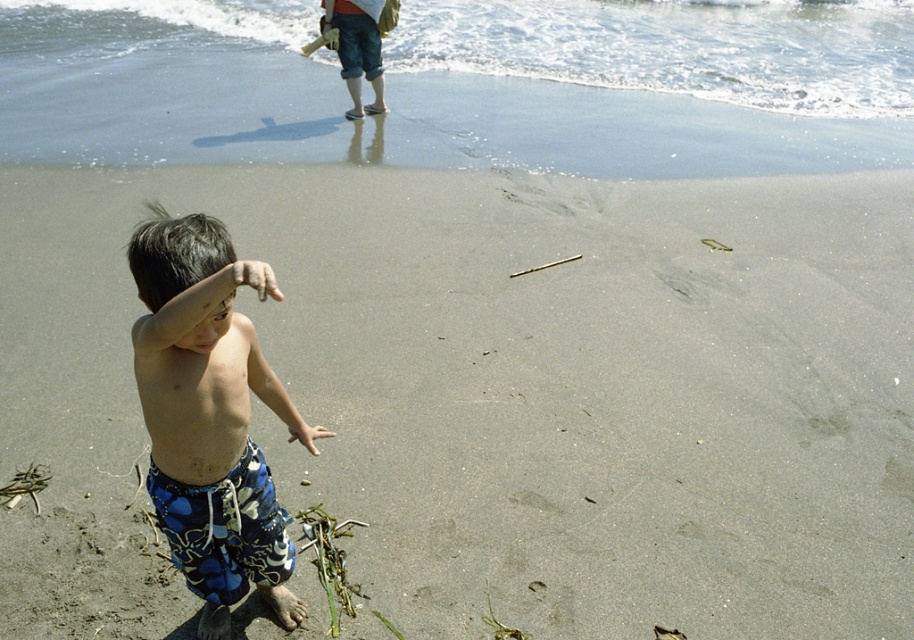
Question: Estimate the real-world distances between objects in this image. Which object is farther from the clear water at upper center?

Choices:
 (A) smooth sand at lower center
 (B) blue printed shorts at lower left

Answer: (A)

Question: Is clear water at upper center below blue printed shorts at lower left?

Choices:
 (A) yes
 (B) no

Answer: (B)

Question: Which of the following is the closest to the observer?

Choices:
 (A) (897, 179)
 (B) (742, 84)

Answer: (A)

Question: Is smooth sand at lower center to the left of blue printed shorts at lower left from the viewer's perspective?

Choices:
 (A) yes
 (B) no

Answer: (B)

Question: Does smooth sand at lower center lie in front of blue printed shorts at lower left?

Choices:
 (A) no
 (B) yes

Answer: (A)

Question: Which object appears closest to the camera in this image?

Choices:
 (A) smooth sand at lower center
 (B) blue printed shorts at lower left

Answer: (B)